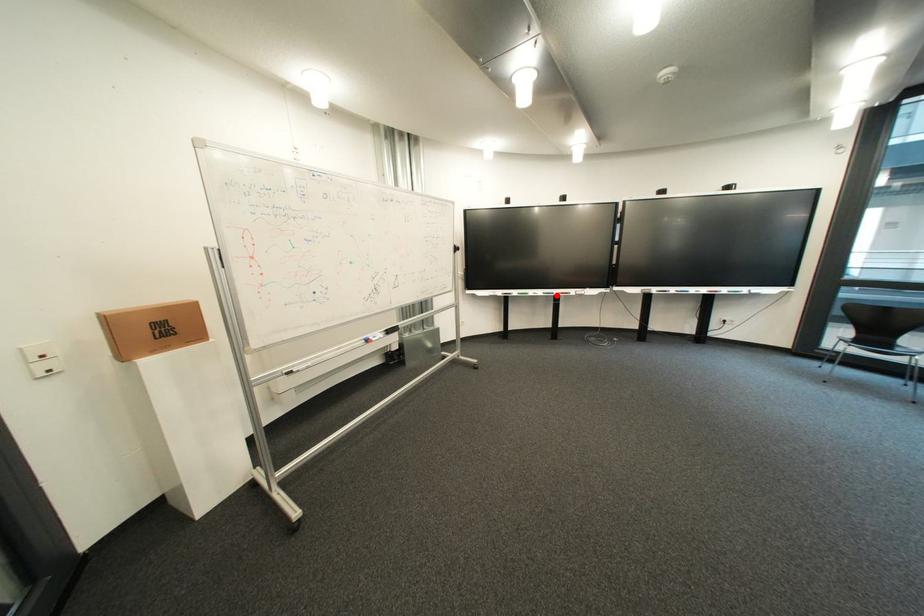
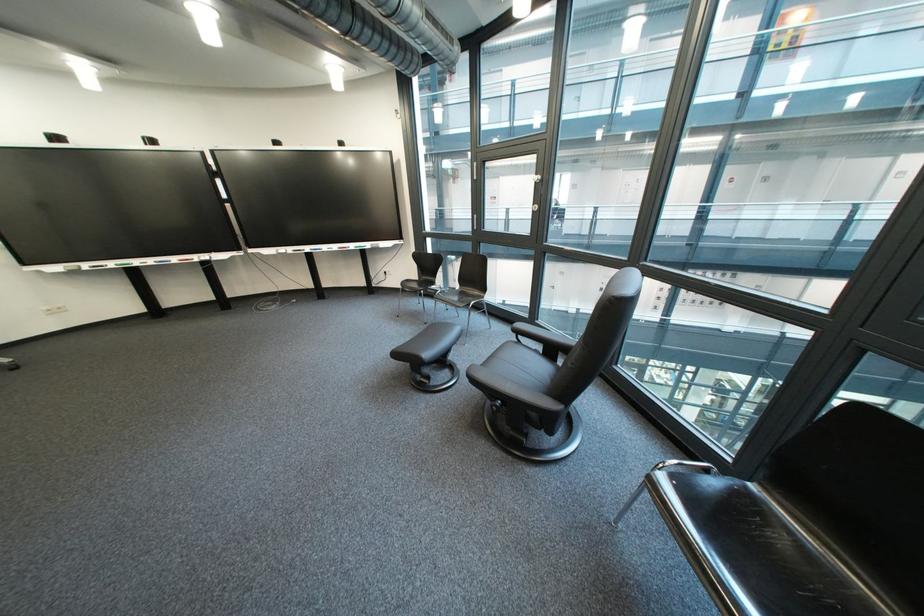
Locate, in the second image, the point that corresponds to the highlighted location in the first image.

(169, 264)